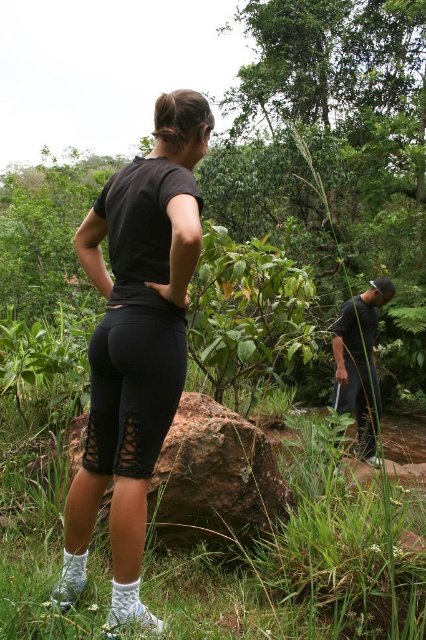
Question: Which object is the farthest from the dark gray fabric shirt at center?

Choices:
 (A) black mesh shorts at lower right
 (B) black matte leggings at center
 (C) black mesh leggings at center

Answer: (C)

Question: Can you confirm if black matte leggings at center is positioned above black mesh shorts at lower right?

Choices:
 (A) yes
 (B) no

Answer: (A)

Question: Which object is farther from the camera taking this photo?

Choices:
 (A) dark gray fabric shirt at center
 (B) black matte leggings at center
 (C) black mesh shorts at lower right

Answer: (C)

Question: Which object is positioned closest to the black mesh shorts at lower right?

Choices:
 (A) black matte leggings at center
 (B) dark gray fabric shirt at center

Answer: (B)

Question: Is the position of black matte leggings at center less distant than that of black mesh leggings at center?

Choices:
 (A) no
 (B) yes

Answer: (B)

Question: Is black mesh leggings at center below dark gray fabric shirt at center?

Choices:
 (A) no
 (B) yes

Answer: (A)